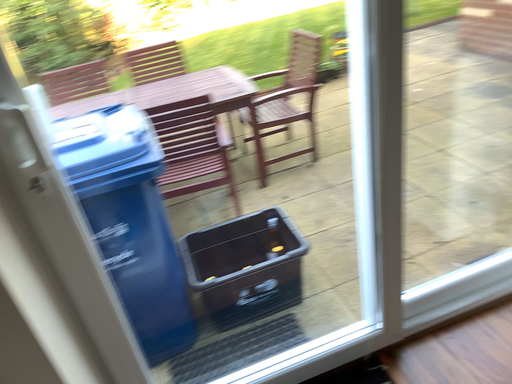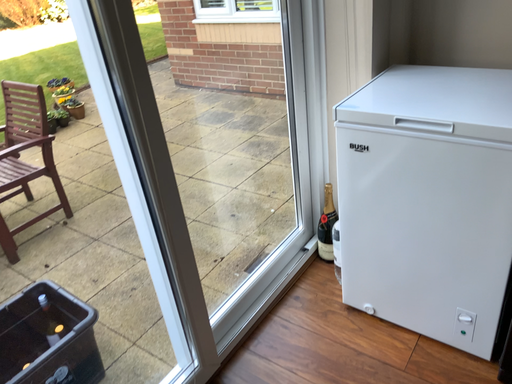
Question: How did the camera likely rotate when shooting the video?

Choices:
 (A) rotated right
 (B) rotated left

Answer: (A)